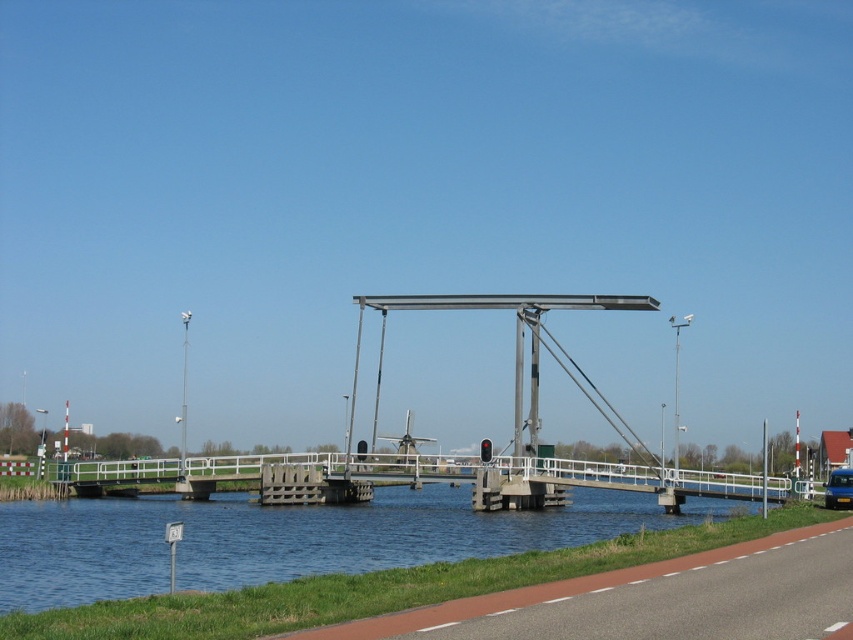
You are driving a car and want to cross the drawbridge. You see the blue water at lower left and the blue metallic van at center. Which object is closer to the left side of the bridge?

The blue water at lower left is positioned on the left side of the blue metallic van at center, so the blue water at lower left is closer to the left side of the bridge.

You are driving a car and want to cross the drawbridge. You see the blue metallic van at center parked on the bridge. Can you safely pass under the blue water at lower left to go around the van?

The blue water at lower left is located below the blue metallic van at center, so you cannot safely pass under it to go around the van since the water is beneath the van and not a path above.